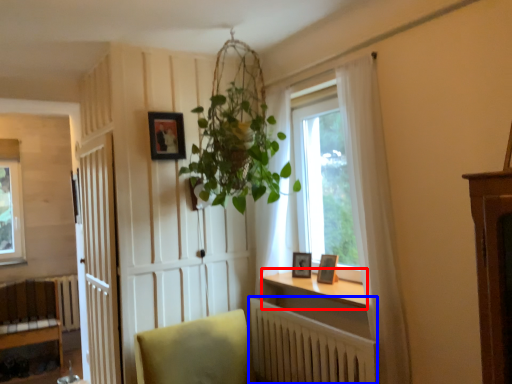
Question: Which of the following is the closest to the observer, window sill (highlighted by a red box) or radiator (highlighted by a blue box)?

Choices:
 (A) window sill
 (B) radiator

Answer: (B)